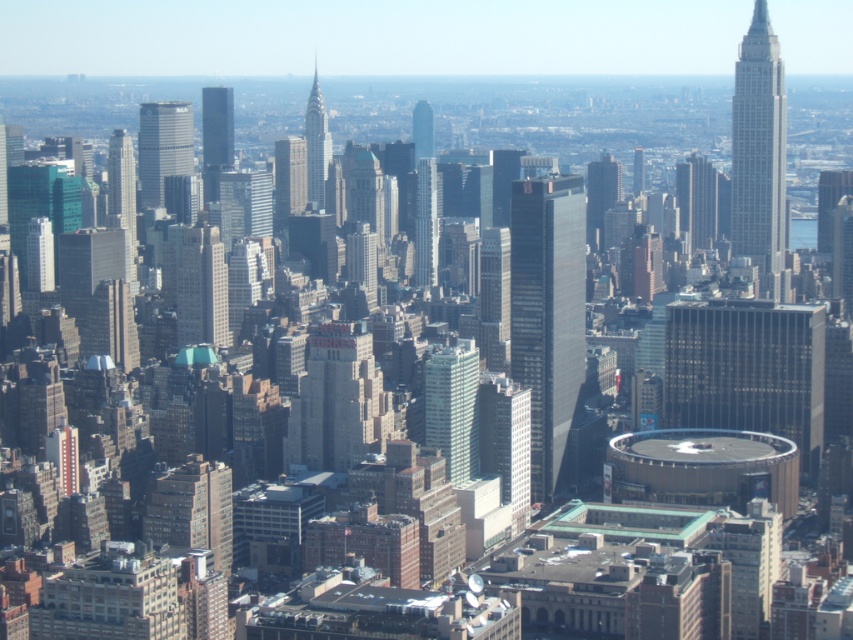
Question: Estimate the real-world distances between objects in this image. Which object is farther from the matte glass skyscraper at center?

Choices:
 (A) glassy skyscraper at center
 (B) silver glass skyscraper at center-left
 (C) matte glass skyscraper at center-left
 (D) green glass skyscraper at center

Answer: (A)

Question: Which object is closer to the camera taking this photo?

Choices:
 (A) gold reflective glass building at center
 (B) white marble skyscraper at upper right
 (C) dark gray glass skyscraper at center
 (D) matte glass skyscraper at center

Answer: (C)

Question: Is green glass skyscraper at center positioned behind glassy skyscraper at center?

Choices:
 (A) no
 (B) yes

Answer: (A)

Question: Which point is closer to the camera?

Choices:
 (A) (186, 104)
 (B) (219, 280)
 (C) (764, 205)
 (D) (430, 145)

Answer: (B)

Question: Does dark gray glass skyscraper at center have a greater width compared to white marble skyscraper at upper right?

Choices:
 (A) yes
 (B) no

Answer: (A)

Question: Is gold reflective glass building at center below glassy skyscraper at center?

Choices:
 (A) yes
 (B) no

Answer: (A)